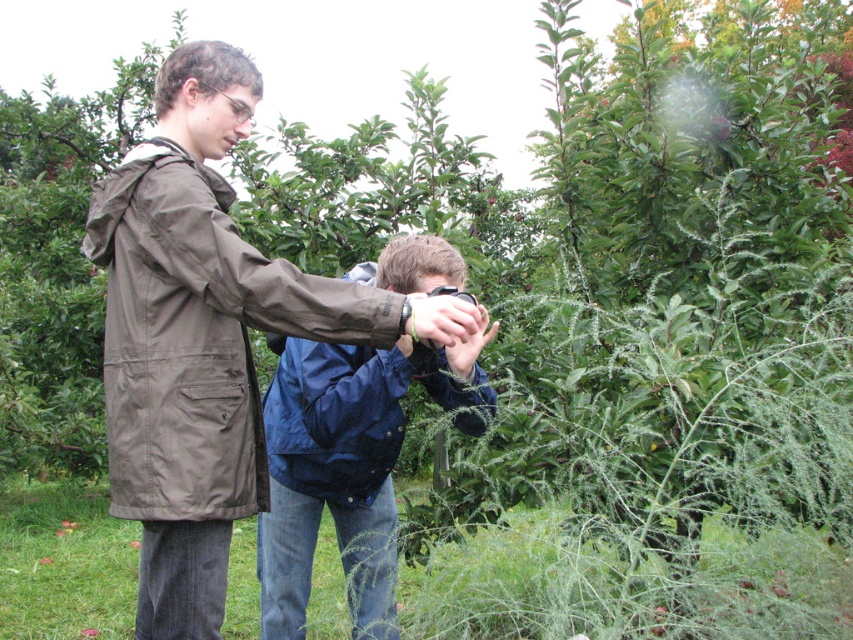
Can you confirm if matte brown jacket at center is thinner than blue fabric camera at center?

No.

Based on the photo, does matte brown jacket at center lie in front of blue fabric camera at center?

That is True.

What do you see at coordinates (206, 337) in the screenshot?
I see `matte brown jacket at center` at bounding box center [206, 337].

Find the location of a particular element. The width and height of the screenshot is (853, 640). matte brown jacket at center is located at coordinates (206, 337).